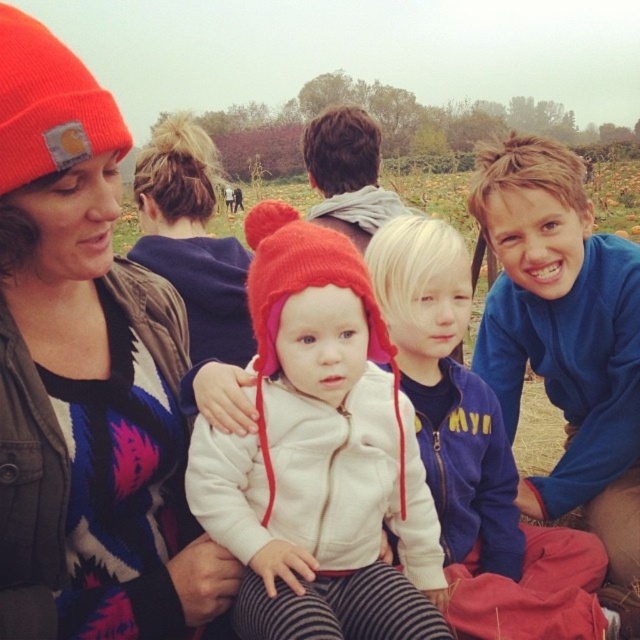
Between point (582, 634) and point (308, 273), which one is positioned in front?

Point (308, 273)

Can you confirm if white fleece jacket at center is bigger than red knitted hat at center?

Yes.

Describe the element at coordinates (474, 454) in the screenshot. I see `white fleece jacket at center` at that location.

What are the coordinates of `white fleece jacket at center` in the screenshot? It's located at (474, 454).

Does blue fleece jacket at lower right lie in front of red knitted hat at center?

No, blue fleece jacket at lower right is further to the viewer.

Does point (598, 252) come closer to viewer compared to point (280, 209)?

That is False.

Identify the location of blue fleece jacket at lower right. This screenshot has height=640, width=640. (563, 336).

Can you confirm if matte orange beanie at upper left is thinner than orange knit beanie at upper left?

Indeed, matte orange beanie at upper left has a lesser width compared to orange knit beanie at upper left.

Looking at this image, does matte orange beanie at upper left have a smaller size compared to orange knit beanie at upper left?

Indeed, matte orange beanie at upper left has a smaller size compared to orange knit beanie at upper left.

Which is behind, point (17, 116) or point (33, 72)?

The point (33, 72) is behind.

Identify the location of matte orange beanie at upper left. (86, 378).